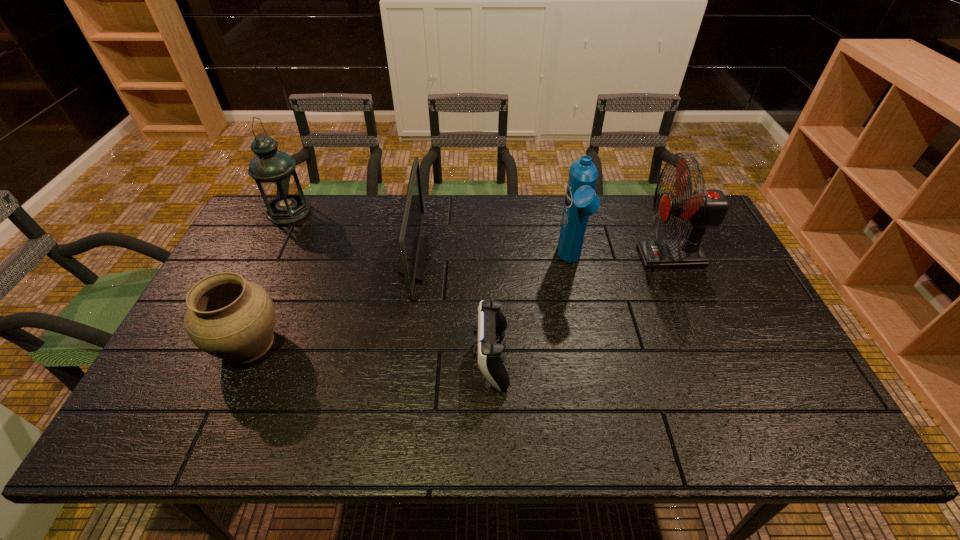
Locate an element on the screen. free space located 0.370m on the front-facing side of the fan is located at coordinates (521, 257).

Where is `free spot located on the front-facing side of the fan`? This screenshot has width=960, height=540. free spot located on the front-facing side of the fan is located at coordinates (547, 257).

Locate an element on the screen. This screenshot has height=540, width=960. free region located on the front of the fifth object from left to right is located at coordinates coord(584,328).

At what (x,y) coordinates should I click in order to perform the action: click on free space located 0.170m on the screen side of the third shortest object. Please return your answer as a coordinate pair (x, y). Looking at the image, I should click on (480, 260).

Identify the location of vacant space positioned on the right of the fifth tallest object. (331, 343).

At what (x,y) coordinates should I click in order to perform the action: click on free location located 0.360m on the front-facing side of the fourth object from left to right. Please return your answer as a coordinate pair (x, y). The width and height of the screenshot is (960, 540). Looking at the image, I should click on (332, 358).

Find the location of `vacant region located 0.260m on the front-facing side of the fourth object from left to right`. vacant region located 0.260m on the front-facing side of the fourth object from left to right is located at coordinates (372, 358).

The height and width of the screenshot is (540, 960). I want to click on free spot located on the front-facing side of the fourth object from left to right, so click(340, 358).

Locate an element on the screen. The width and height of the screenshot is (960, 540). oil lamp that is at the far edge is located at coordinates (274, 171).

Where is `fan located at the far edge`? Image resolution: width=960 pixels, height=540 pixels. fan located at the far edge is located at coordinates (704, 208).